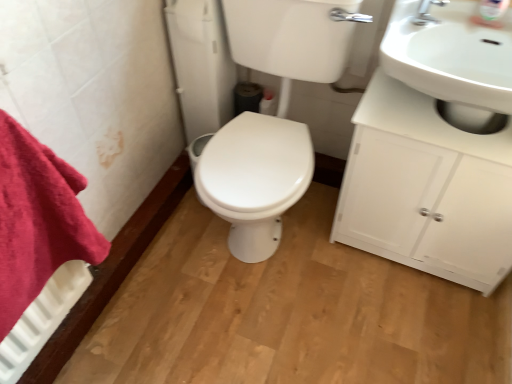
Measure the distance between point (220, 133) and camera.

The distance of point (220, 133) from camera is 4.70 feet.

In order to face white glossy cabinet at right, should I rotate leftwards or rightwards?

It's best to rotate right around 23.073 degrees.

Find the location of `white glossy cabinet at right`. white glossy cabinet at right is located at coordinates (426, 189).

Identify the location of white glossy sink at upper right. tap(450, 55).

Which of these two, red cotton towel at left or white glossy cabinet at right, is thinner?

Thinner between the two is red cotton towel at left.

How different are the orientations of red cotton towel at left and white glossy cabinet at right in degrees?

red cotton towel at left and white glossy cabinet at right are facing 92.3 degrees away from each other.

Would you say red cotton towel at left is a long distance from white glossy cabinet at right?

Actually, red cotton towel at left and white glossy cabinet at right are a little close together.

From the image's perspective, which is below, red cotton towel at left or white glossy cabinet at right?

red cotton towel at left is shown below in the image.

Is white glossy toilet at center far away from silver metallic faucet at upper right?

That's not correct — white glossy toilet at center is a little close to silver metallic faucet at upper right.

How many degrees apart are the facing directions of white glossy toilet at center and silver metallic faucet at upper right?

→ The angular difference between white glossy toilet at center and silver metallic faucet at upper right is 2.5 degrees.

Is white glossy toilet at center behind silver metallic faucet at upper right?

No, white glossy toilet at center is in front of silver metallic faucet at upper right.

Which of these two, white glossy toilet at center or silver metallic faucet at upper right, is smaller?

silver metallic faucet at upper right.

Locate an element on the screen. Image resolution: width=512 pixels, height=384 pixels. porcelain located underneath the red cotton towel at left (from a real-world perspective) is located at coordinates (271, 117).

From the image's perspective, between white glossy toilet at center and red cotton towel at left, which one is located above?

From the image's view, white glossy toilet at center is above.

Which is closer, (278, 134) or (67, 257)?

Point (278, 134) appears to be farther away from the viewer than point (67, 257).

From the image's perspective, between white glossy sink at upper right and silver metallic faucet at upper right, who is located below?

white glossy sink at upper right, from the image's perspective.

Locate an element on the screen. sink that appears on the right of silver metallic faucet at upper right is located at coordinates (450, 55).

In terms of width, does white glossy sink at upper right look wider or thinner when compared to silver metallic faucet at upper right?

Considering their sizes, white glossy sink at upper right looks broader than silver metallic faucet at upper right.

Could silver metallic faucet at upper right be considered to be inside white glossy sink at upper right?

Yes, silver metallic faucet at upper right is surrounded by white glossy sink at upper right.

Locate an element on the screen. sink on the right of white glossy toilet at center is located at coordinates (450, 55).

From the image's perspective, who appears lower, white glossy toilet at center or white glossy sink at upper right?

white glossy toilet at center.

Is point (315, 27) positioned after point (462, 65)?

That is False.

How many degrees apart are the facing directions of white glossy toilet at center and white glossy sink at upper right?

white glossy toilet at center and white glossy sink at upper right are facing 2.5 degrees away from each other.

Can white glossy cabinet at right be found inside silver metallic faucet at upper right?

No, white glossy cabinet at right is not inside silver metallic faucet at upper right.

Which point is more forward, (419, 11) or (480, 168)?

Point (480, 168)

From the image's perspective, is silver metallic faucet at upper right under white glossy cabinet at right?

No, from the image's perspective, silver metallic faucet at upper right is not below white glossy cabinet at right.

From the picture: Is silver metallic faucet at upper right positioned with its back to white glossy cabinet at right?

No.

Is point (468, 69) farther from camera compared to point (250, 250)?

No, it is not.

Are white glossy sink at upper right and white glossy toilet at center located far from each other?

No.

Considering the relative sizes of white glossy sink at upper right and white glossy toilet at center in the image provided, is white glossy sink at upper right thinner than white glossy toilet at center?

Correct, the width of white glossy sink at upper right is less than that of white glossy toilet at center.

Does white glossy sink at upper right turn towards white glossy toilet at center?

No, white glossy sink at upper right is not facing towards white glossy toilet at center.

Find the location of a particular element. bath towel in front of the white glossy cabinet at right is located at coordinates (38, 220).

Find the location of a particular element. tap above the white glossy toilet at center (from a real-world perspective) is located at coordinates (426, 12).

When comparing their distances from silver metallic faucet at upper right, does red cotton towel at left or white glossy cabinet at right seem further?

red cotton towel at left.

Looking at the image, which one is located further to red cotton towel at left, white glossy cabinet at right or white glossy toilet at center?

white glossy cabinet at right is further to red cotton towel at left.

When comparing their distances from silver metallic faucet at upper right, does white glossy sink at upper right or red cotton towel at left seem further?

red cotton towel at left.

Estimate the real-world distances between objects in this image. Which object is further from white glossy cabinet at right, white glossy sink at upper right or red cotton towel at left?

Based on the image, red cotton towel at left appears to be further to white glossy cabinet at right.

Looking at this image, based on their spatial positions, is red cotton towel at left or white glossy toilet at center closer to white glossy sink at upper right?

Among the two, white glossy toilet at center is located nearer to white glossy sink at upper right.

Looking at the image, which one is located closer to silver metallic faucet at upper right, red cotton towel at left or white glossy sink at upper right?

Based on the image, white glossy sink at upper right appears to be nearer to silver metallic faucet at upper right.

Looking at this image, considering their positions, is silver metallic faucet at upper right positioned further to white glossy cabinet at right than red cotton towel at left?

Based on the image, red cotton towel at left appears to be further to white glossy cabinet at right.

When comparing their distances from silver metallic faucet at upper right, does white glossy cabinet at right or white glossy toilet at center seem closer?

Based on the image, white glossy cabinet at right appears to be nearer to silver metallic faucet at upper right.

Where is `porcelain between red cotton towel at left and silver metallic faucet at upper right from left to right`? This screenshot has width=512, height=384. porcelain between red cotton towel at left and silver metallic faucet at upper right from left to right is located at coordinates (271, 117).

I want to click on sink between silver metallic faucet at upper right and white glossy cabinet at right in the up-down direction, so click(x=450, y=55).

You are a GUI agent. You are given a task and a screenshot of the screen. Output one action in this format:
    pyautogui.click(x=<x>, y=<y>)
    Task: Click on the tap situated between white glossy toilet at center and white glossy cabinet at right from left to right
    Image resolution: width=512 pixels, height=384 pixels.
    Given the screenshot: What is the action you would take?
    pyautogui.click(x=426, y=12)

Identify the location of tap located between white glossy toilet at center and white glossy sink at upper right in the left-right direction. Image resolution: width=512 pixels, height=384 pixels. (426, 12).